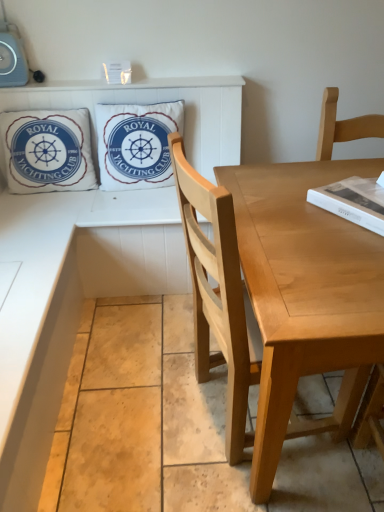
What do you see at coordinates (353, 201) in the screenshot? I see `white matte book at upper right` at bounding box center [353, 201].

The width and height of the screenshot is (384, 512). What do you see at coordinates (48, 151) in the screenshot?
I see `white cotton pillow at upper left, the first pillow from the left` at bounding box center [48, 151].

Measure the distance between point (73, 188) and camera.

Point (73, 188) and camera are 6.93 feet apart.

Find the location of a particular element. wooden table at lower left is located at coordinates (66, 310).

Is wooden table at lower left bigger than white cotton pillow at upper center, placed as the 2th pillow when sorted from left to right?

Correct, wooden table at lower left is larger in size than white cotton pillow at upper center, placed as the 2th pillow when sorted from left to right.

Identify the location of the 2nd pillow behind when counting from the wooden table at lower left. (136, 144).

In the image, is wooden table at lower left on the left side or the right side of white cotton pillow at upper center, placed as the 2th pillow when sorted from left to right?

wooden table at lower left is to the right of white cotton pillow at upper center, placed as the 2th pillow when sorted from left to right.

This screenshot has height=512, width=384. Find the location of `the 1st pillow behind the white matte book at upper right, starting your count from the anchor`. the 1st pillow behind the white matte book at upper right, starting your count from the anchor is located at coordinates (48, 151).

Relative to white cotton pillow at upper left, the first pillow from the left, is white matte book at upper right in front or behind?

white matte book at upper right is in front of white cotton pillow at upper left, the first pillow from the left.

Between white matte book at upper right and white cotton pillow at upper left, the first pillow from the left, which one appears on the right side from the viewer's perspective?

white matte book at upper right is more to the right.

Measure the distance between white matte book at upper right and white cotton pillow at upper left, which is the second pillow in right-to-left order.

The distance of white matte book at upper right from white cotton pillow at upper left, which is the second pillow in right-to-left order, is 1.31 meters.

Would you say wooden table at lower left is part of white cotton pillow at upper left, the first pillow from the left,'s contents?

No, wooden table at lower left is not a part of white cotton pillow at upper left, the first pillow from the left.

From the picture: Measure the distance from white cotton pillow at upper left, the first pillow from the left, to wooden table at lower left.

14.03 inches.

Would you say white cotton pillow at upper left, which is the second pillow in right-to-left order, is to the left or to the right of wooden table at lower left in the picture?

From the image, it's evident that white cotton pillow at upper left, which is the second pillow in right-to-left order, is to the left of wooden table at lower left.

Can you tell me how much white cotton pillow at upper left, the first pillow from the left, and wooden table at lower left differ in facing direction?

The angle between the facing direction of white cotton pillow at upper left, the first pillow from the left, and the facing direction of wooden table at lower left is 87.8 degrees.

Which is closer to the camera, (x=113, y=136) or (x=333, y=184)?

Positioned in front is point (x=333, y=184).

Relative to white matte book at upper right, is white cotton pillow at upper center, which is the first pillow in right-to-left order, in front or behind?

white cotton pillow at upper center, which is the first pillow in right-to-left order, is positioned farther from the viewer than white matte book at upper right.

Considering the relative sizes of white cotton pillow at upper center, which is the first pillow in right-to-left order, and white matte book at upper right in the image provided, is white cotton pillow at upper center, which is the first pillow in right-to-left order, smaller than white matte book at upper right?

Actually, white cotton pillow at upper center, which is the first pillow in right-to-left order, might be larger than white matte book at upper right.

Is white cotton pillow at upper center, placed as the 2th pillow when sorted from left to right, far away from white matte book at upper right?

Indeed, white cotton pillow at upper center, placed as the 2th pillow when sorted from left to right, is not near white matte book at upper right.

Is there a large distance between white matte book at upper right and light brown wood chair at right?

white matte book at upper right is actually quite close to light brown wood chair at right.

Between white matte book at upper right and light brown wood chair at right, which one is positioned in front?

Positioned in front is light brown wood chair at right.

From the image's perspective, relative to light brown wood chair at right, is white matte book at upper right above or below?

Clearly, from the image's perspective, white matte book at upper right is above light brown wood chair at right.

Can light brown wood chair at right be found inside white matte book at upper right?

No, light brown wood chair at right is not inside white matte book at upper right.

From a real-world perspective, is white cotton pillow at upper left, the first pillow from the left, positioned above or below white cotton pillow at upper center, which is the first pillow in right-to-left order?

Clearly, from a real-world perspective, white cotton pillow at upper left, the first pillow from the left, is below white cotton pillow at upper center, which is the first pillow in right-to-left order.

Is white cotton pillow at upper left, the first pillow from the left, positioned with its back to white cotton pillow at upper center, which is the first pillow in right-to-left order?

That's not correct — white cotton pillow at upper left, the first pillow from the left, is not looking away from white cotton pillow at upper center, which is the first pillow in right-to-left order.

Is white cotton pillow at upper left, which is the second pillow in right-to-left order, not within white cotton pillow at upper center, placed as the 2th pillow when sorted from left to right?

Yes.

Which object is positioned more to the left, white cotton pillow at upper left, which is the second pillow in right-to-left order, or white cotton pillow at upper center, which is the first pillow in right-to-left order?

white cotton pillow at upper left, which is the second pillow in right-to-left order, is more to the left.

Between wooden table at lower left and light brown wood chair at right, which one has more height?

Standing taller between the two is light brown wood chair at right.

Do you think wooden table at lower left is within light brown wood chair at right, or outside of it?

wooden table at lower left is spatially situated outside light brown wood chair at right.

Is wooden table at lower left positioned with its back to light brown wood chair at right?

No, light brown wood chair at right is not at the back of wooden table at lower left.

Identify the location of counter that is under the white cotton pillow at upper center, which is the first pillow in right-to-left order (from a real-world perspective). The image size is (384, 512). (66, 310).

Locate an element on the screen. Image resolution: width=384 pixels, height=512 pixels. pillow that is the 2nd object to the left of the white matte book at upper right, starting at the anchor is located at coordinates (48, 151).

Considering their positions, is light brown wood chair at right positioned further to wooden table at lower left than white cotton pillow at upper left, the first pillow from the left?

Among the two, light brown wood chair at right is located further to wooden table at lower left.

Which object lies further to the anchor point light brown wood chair at right, wooden table at lower left or white cotton pillow at upper left, the first pillow from the left?

The object further to light brown wood chair at right is white cotton pillow at upper left, the first pillow from the left.

From the image, which object appears to be farther from white matte book at upper right, light brown wood chair at right or white cotton pillow at upper center, which is the first pillow in right-to-left order?

white cotton pillow at upper center, which is the first pillow in right-to-left order, is positioned further to the anchor white matte book at upper right.

From the image, which object appears to be nearer to light brown wood chair at right, white cotton pillow at upper center, which is the first pillow in right-to-left order, or white cotton pillow at upper left, which is the second pillow in right-to-left order?

Among the two, white cotton pillow at upper center, which is the first pillow in right-to-left order, is located nearer to light brown wood chair at right.

Which object lies further to the anchor point light brown wood chair at right, white cotton pillow at upper center, placed as the 2th pillow when sorted from left to right, or wooden table at lower left?

white cotton pillow at upper center, placed as the 2th pillow when sorted from left to right, lies further to light brown wood chair at right than the other object.

Based on their spatial positions, is light brown wood chair at right or white cotton pillow at upper center, which is the first pillow in right-to-left order, further from white cotton pillow at upper left, which is the second pillow in right-to-left order?

Among the two, light brown wood chair at right is located further to white cotton pillow at upper left, which is the second pillow in right-to-left order.

Considering their positions, is white cotton pillow at upper left, which is the second pillow in right-to-left order, positioned further to white matte book at upper right than white cotton pillow at upper center, placed as the 2th pillow when sorted from left to right?

Based on the image, white cotton pillow at upper left, which is the second pillow in right-to-left order, appears to be further to white matte book at upper right.

Estimate the real-world distances between objects in this image. Which object is closer to white cotton pillow at upper center, placed as the 2th pillow when sorted from left to right, wooden table at lower left or white matte book at upper right?

Among the two, wooden table at lower left is located nearer to white cotton pillow at upper center, placed as the 2th pillow when sorted from left to right.

This screenshot has height=512, width=384. Identify the location of counter located between white cotton pillow at upper left, which is the second pillow in right-to-left order, and white matte book at upper right in the left-right direction. (66, 310).

Image resolution: width=384 pixels, height=512 pixels. I want to click on magazine between white cotton pillow at upper center, placed as the 2th pillow when sorted from left to right, and wooden table at lower left vertically, so click(353, 201).

Where is `counter between light brown wood chair at right and white cotton pillow at upper center, which is the first pillow in right-to-left order, from front to back`? The height and width of the screenshot is (512, 384). counter between light brown wood chair at right and white cotton pillow at upper center, which is the first pillow in right-to-left order, from front to back is located at coordinates (66, 310).

Locate an element on the screen. chair that lies between white matte book at upper right and wooden table at lower left from top to bottom is located at coordinates (217, 295).